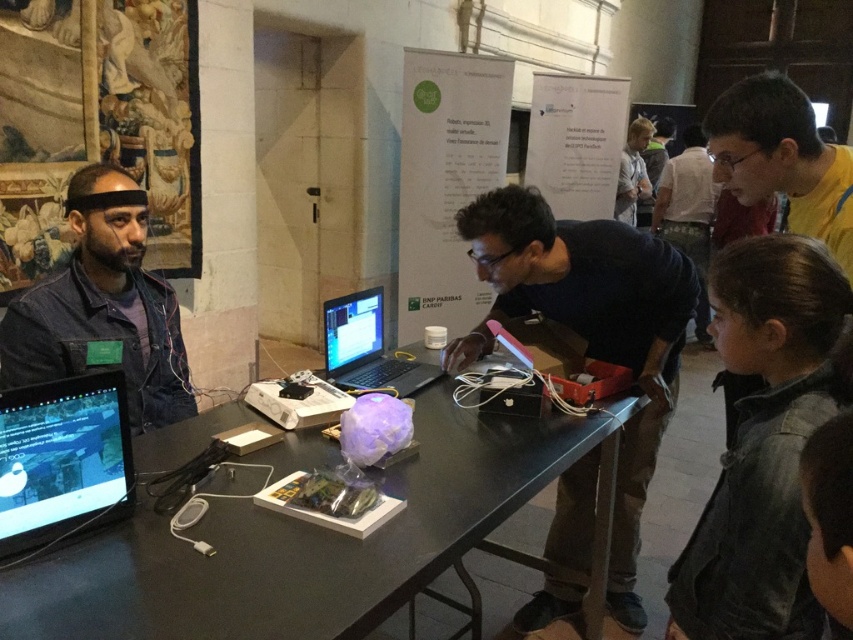
Question: Can you confirm if black glossy table at center is bigger than matte black laptop at center?

Choices:
 (A) no
 (B) yes

Answer: (B)

Question: Which of the following is the closest to the observer?

Choices:
 (A) (701, 170)
 (B) (660, 385)
 (C) (79, 371)

Answer: (C)

Question: Is the position of black glossy table at center less distant than that of matte black shirt at upper right?

Choices:
 (A) yes
 (B) no

Answer: (A)

Question: Among these objects, which one is farthest from the camera?

Choices:
 (A) denim jacket at left
 (B) matte black laptop at center
 (C) matte black laptop at left
 (D) dark blue shirt at center

Answer: (B)

Question: Which of the following is the closest to the observer?

Choices:
 (A) (805, 120)
 (B) (711, 205)

Answer: (A)

Question: Can you confirm if denim jacket at left is bigger than matte black shirt at upper right?

Choices:
 (A) no
 (B) yes

Answer: (A)